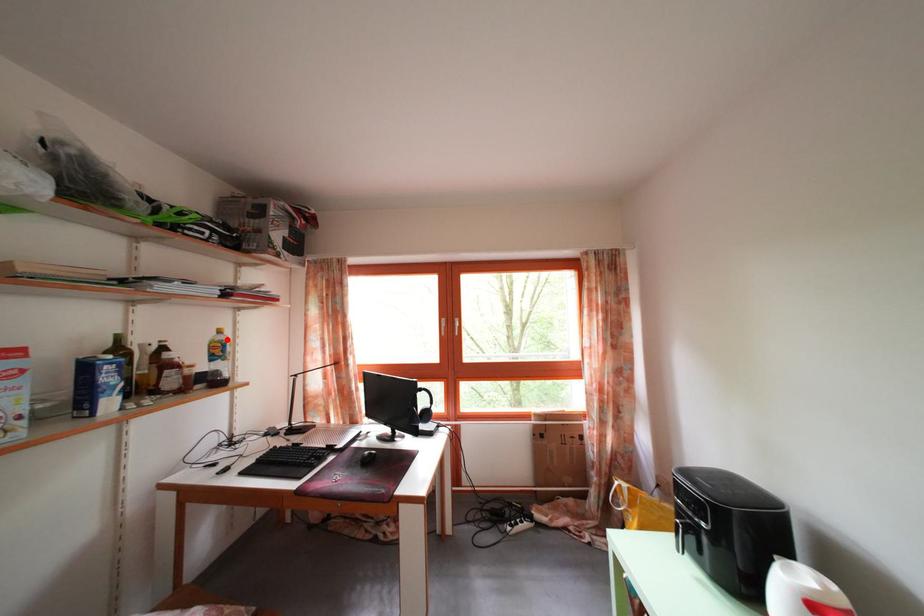
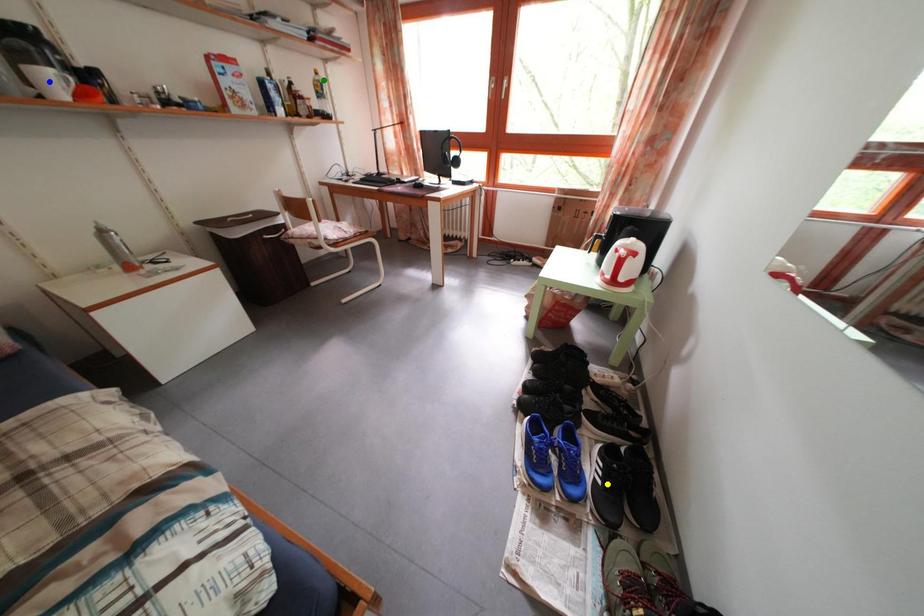
Question: I am providing you with two images of the same scene from different viewpoints. A red point is marked on the first image. You are given multiple points on the second image. Can you choose the point in image 2 that corresponds to the point in image 1?

Choices:
 (A) green point
 (B) yellow point
 (C) blue point

Answer: (A)